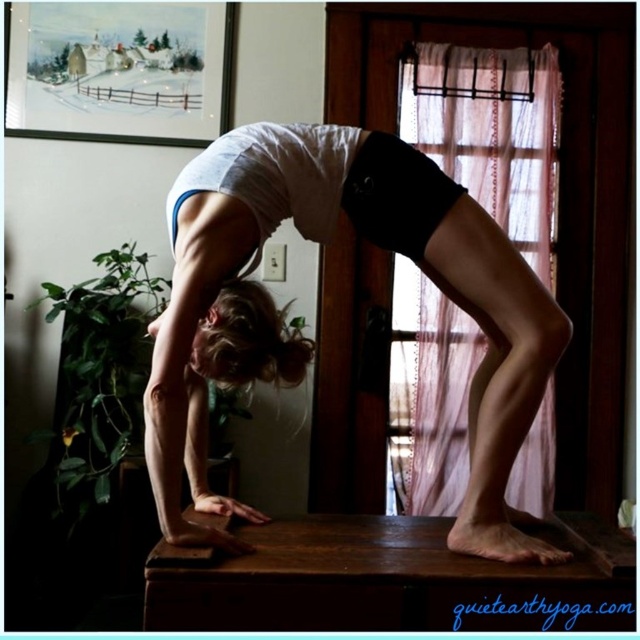
You are a photographer setting up a shoot in this room. You need to ensure that the white cotton shirt at center and the sheer pink fabric at upper center are both visible in the frame. Given their sizes, which object should you focus on to include both in the composition?

Since the white cotton shirt at center is larger than the sheer pink fabric at upper center, you should focus on the white cotton shirt at center to ensure both objects are visible in the frame.

You are a photographer setting up for a yoga session. You need to place a small prop at the exact center of the image. However, you notice that there is already an object at point (308, 339). What is the object located at that point?

The object at point (308, 339) is the white cotton shirt at center.